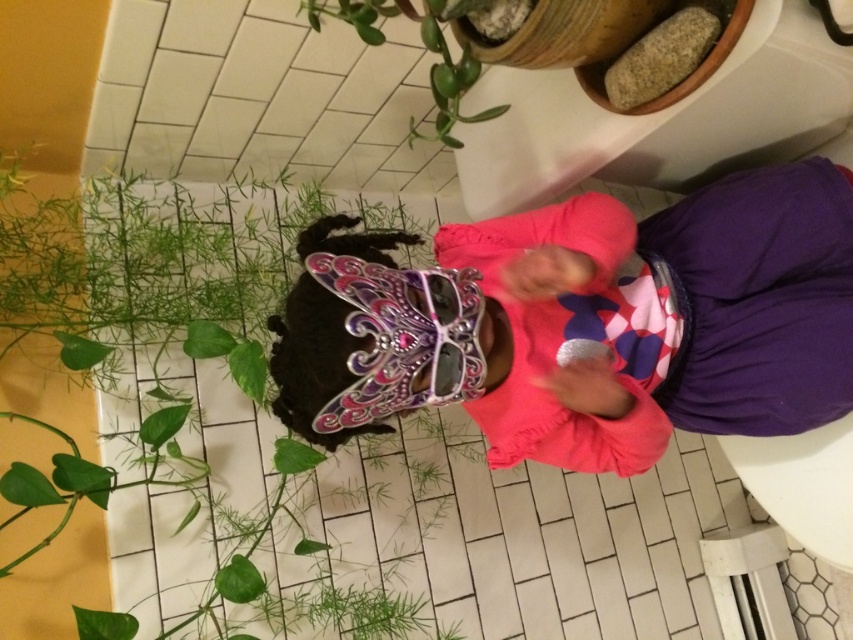
You are standing in a bathroom and need to place a new decorative item exactly at point (178, 358). What object is already located there?

The green leafy plant at center is located at point (178, 358).

Consider the image. You are standing in a bathroom and see two points marked on the wall. The first point is at position point (808, 216) and the second point is at position point (250, 294). Which point is closer to you?

Point (808, 216) is closer to the camera than point (250, 294).

You are a photographer setting up a shoot in this scene. You need to position a light source to the right of both the green leafy plant at center and the green glossy plant at upper center. Is this possible based on their positions?

The green leafy plant at center is to the left of the green glossy plant at upper center, so positioning a light source to the right of both is possible as they are aligned horizontally with the leafy plant on the left side.